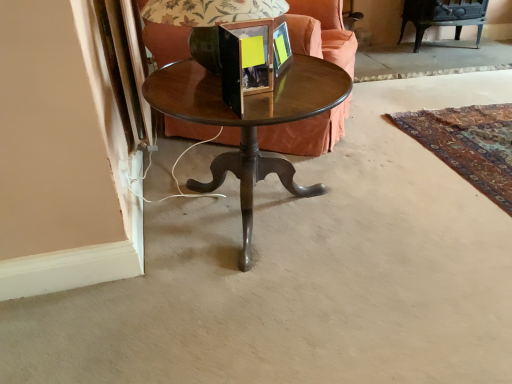
Find the location of a particular element. This screenshot has width=512, height=384. vacant area that is in front of wooden round table at center is located at coordinates (289, 316).